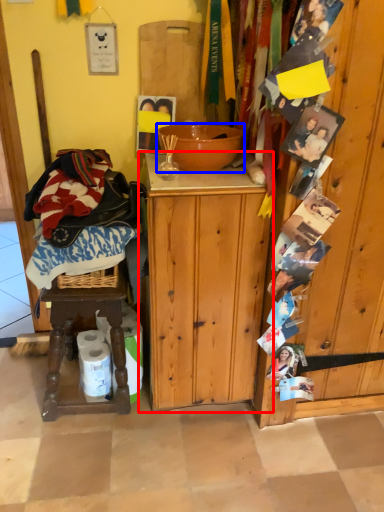
Question: Which object is closer to the camera taking this photo, cabinetry (highlighted by a red box) or bowl (highlighted by a blue box)?

Choices:
 (A) cabinetry
 (B) bowl

Answer: (A)